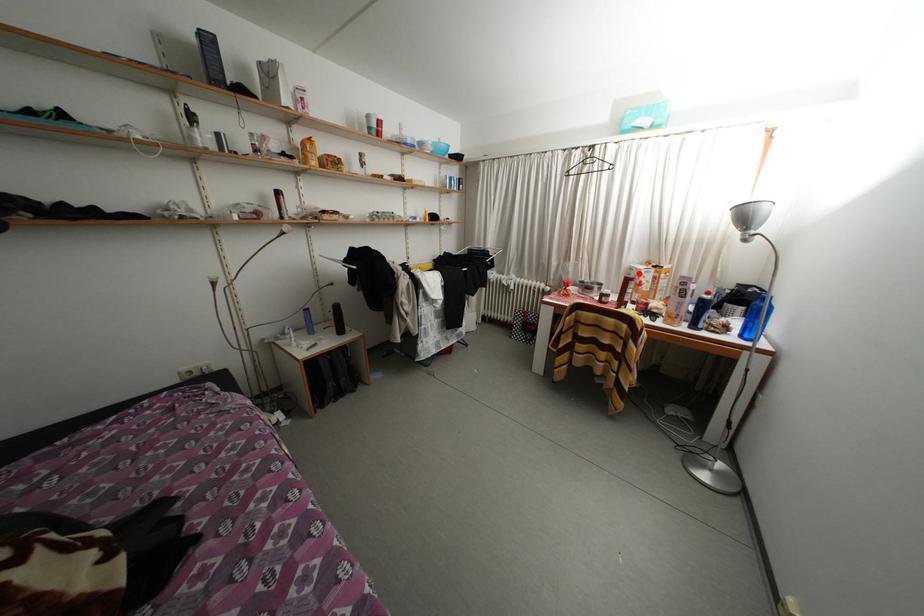
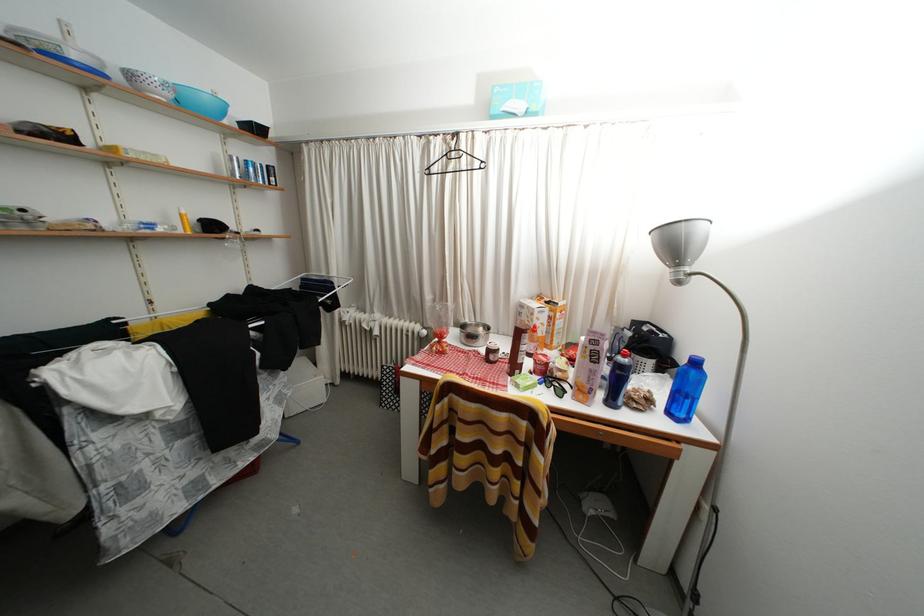
The point at the highlighted location is marked in the first image. Where is the corresponding point in the second image?

(529, 310)